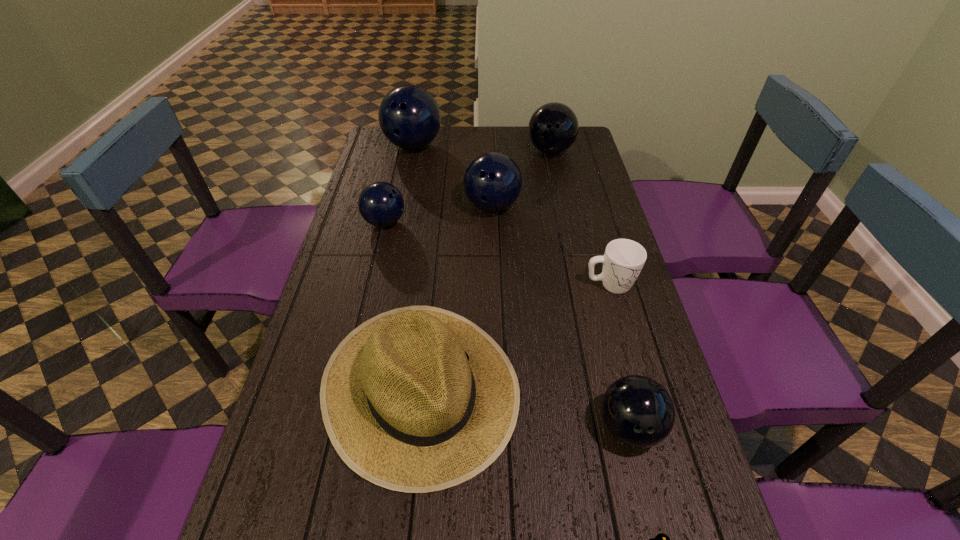
In the image, there is a desktop. At what (x,y) coordinates should I click in order to perform the action: click on vacant region at the far edge. Please return your answer as a coordinate pair (x, y). The image size is (960, 540). Looking at the image, I should click on (499, 131).

At what (x,y) coordinates should I click in order to perform the action: click on vacant region at the left edge of the desktop. Please return your answer as a coordinate pair (x, y). Looking at the image, I should click on (389, 174).

At what (x,y) coordinates should I click in order to perform the action: click on free region at the right edge of the desktop. Please return your answer as a coordinate pair (x, y). Image resolution: width=960 pixels, height=540 pixels. Looking at the image, I should click on (645, 321).

Find the location of `vacant space at the far right corner`. vacant space at the far right corner is located at coordinates (579, 149).

Identify the location of free space between the farther black bowling ball and the black sunhat. Image resolution: width=960 pixels, height=540 pixels. (486, 269).

In order to click on vacant point located between the sunhat and the smallest blue bowling ball in this screenshot , I will do `click(402, 305)`.

Image resolution: width=960 pixels, height=540 pixels. Identify the location of unoccupied area between the smallest blue bowling ball and the tallest object. pyautogui.click(x=399, y=184).

Find the location of `blank region between the smallest blue bowling ball and the smaller black bowling ball`. blank region between the smallest blue bowling ball and the smaller black bowling ball is located at coordinates (507, 325).

Identify the location of unoccupied position between the sunhat and the fourth nearest object. The height and width of the screenshot is (540, 960). (515, 335).

The width and height of the screenshot is (960, 540). What are the coordinates of `vacant space that is in between the rightmost blue bowling ball and the biggest blue bowling ball` in the screenshot? It's located at (453, 176).